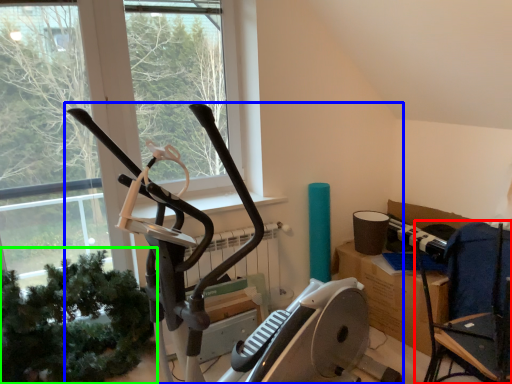
Question: Based on their relative distances, which object is nearer to chair (highlighted by a red box)? Choose from stationary bicycle (highlighted by a blue box) and plant (highlighted by a green box).

Choices:
 (A) stationary bicycle
 (B) plant

Answer: (A)